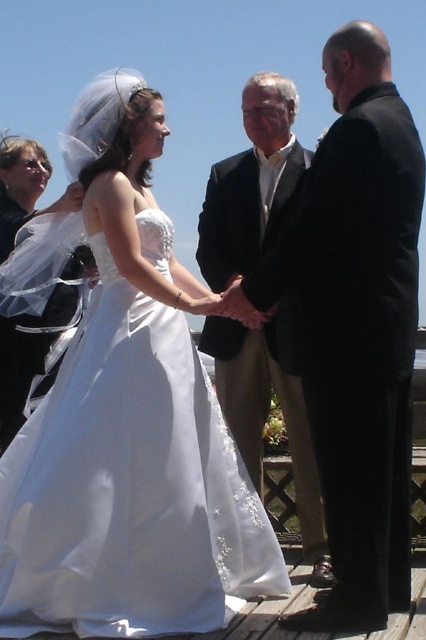
You are standing at the point with coordinates point [34,369] and want to walk to the point with coordinates point [316,241]. According to the scene, will you have to walk towards the front or the back?

Point [316,241] is in front of point [34,369], so you will have to walk towards the front.

You are a photographer capturing the wedding ceremony. You need to ensure both the white satin dress at center and the light beige cotton suit at center are clearly visible in the frame. Based on their sizes, which one should you focus on first to ensure it fits within the camera view?

The white satin dress at center is smaller than the light beige cotton suit at center, so you should focus on the light beige cotton suit at center first to ensure it fits within the camera view before adjusting for the smaller dress.